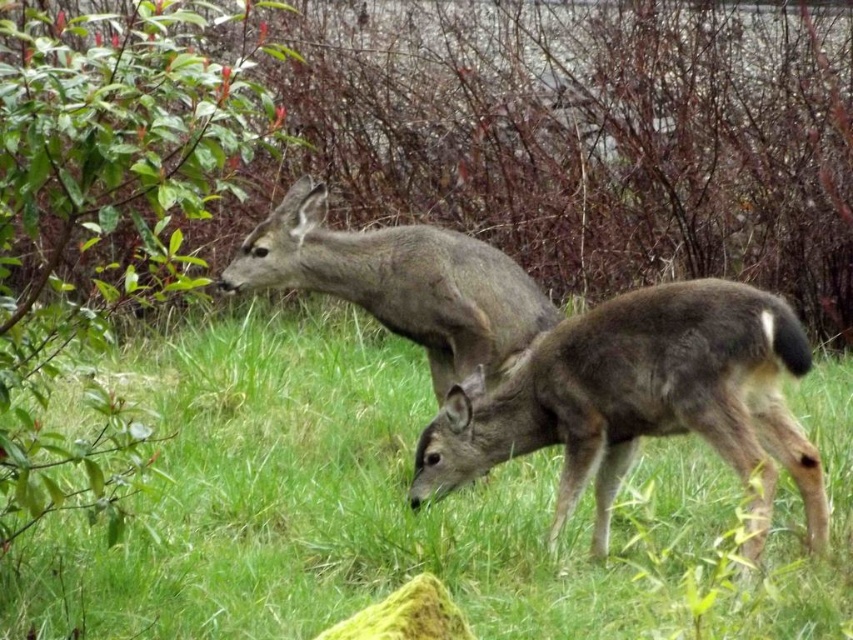
You are a photographer trying to capture a closeup shot of the gray fur roe deer at center. However, the green grassy at center is blocking your view. Can you estimate whether the deer is taller than the grass?

The green grassy at center has a larger size compared to gray fur roe deer at center, so the deer is taller than the grass.

You are standing at the origin point of the coordinate system in the image. The green grassy area is at a specific coordinate. Can you determine the exact coordinates of the green grassy at center?

The green grassy at center is located at coordinates point (403, 509).

You are a photographer trying to capture a clear image of the brown fur roe deer at center without the green grassy at center blocking it. How can you adjust your camera angle to achieve this?

The green grassy at center is located above the brown fur roe deer at center, so you can lower your camera angle to position it below the deer, allowing the deer to be framed against the grass instead of being obscured by it.